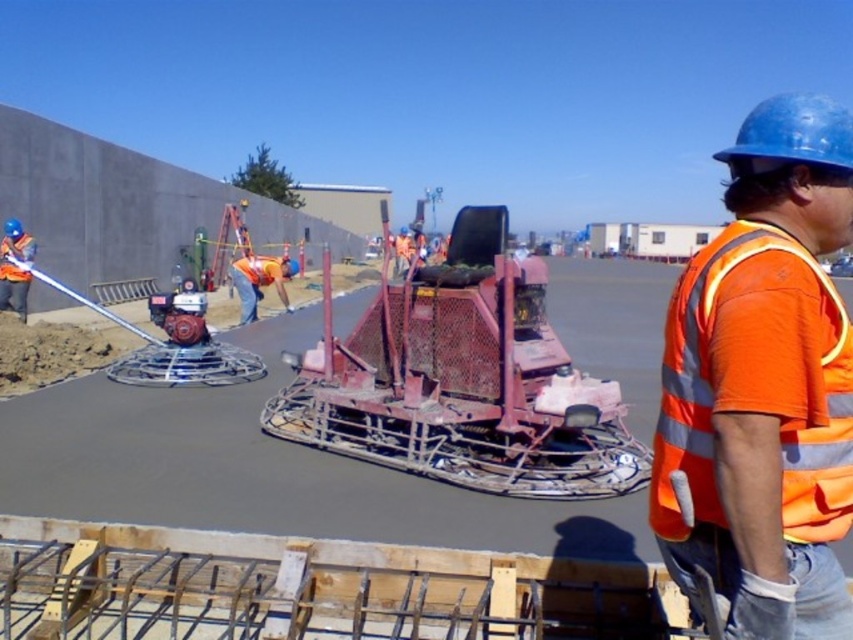
Does orange reflective vest at center have a greater width compared to rusty metal machine at center?

Incorrect, orange reflective vest at center's width does not surpass rusty metal machine at center's.

Is point (744, 163) more distant than point (293, 404)?

No, it is in front of (293, 404).

Is point (788, 625) closer to camera compared to point (328, 451)?

That is True.

Identify the location of orange reflective vest at center. Image resolution: width=853 pixels, height=640 pixels. (764, 385).